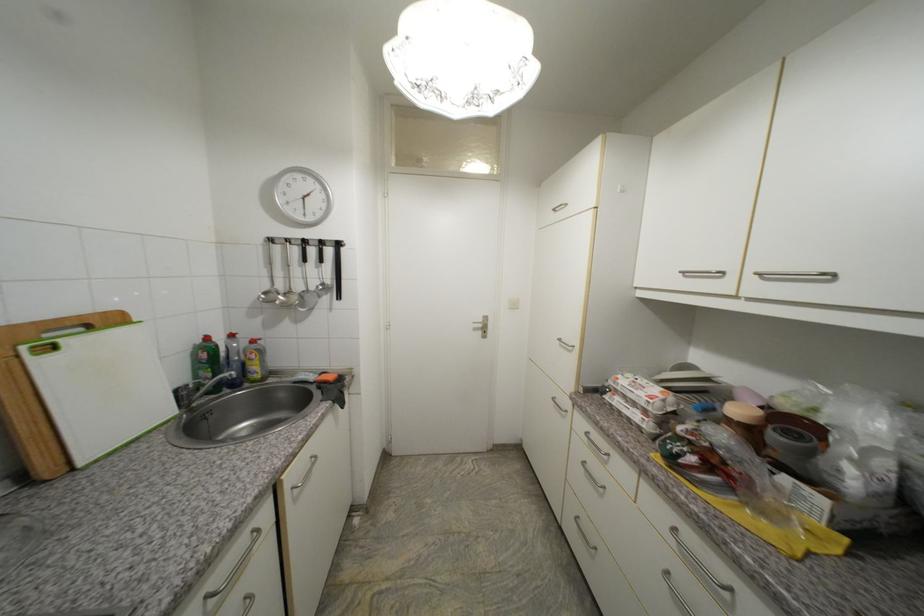
Find the location of a particular element. The height and width of the screenshot is (616, 924). wooden cutting board is located at coordinates (38, 392).